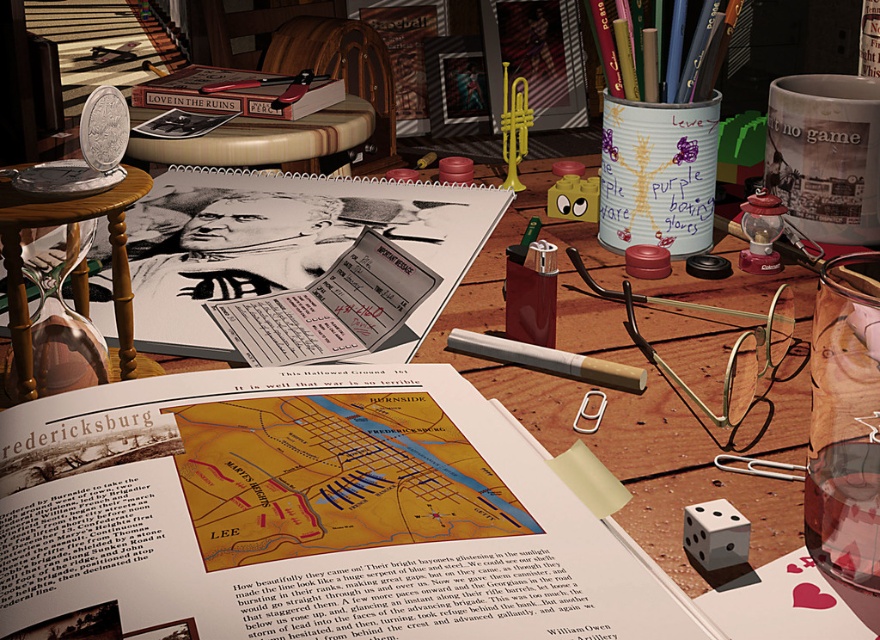
You are organizing a desk and need to place a large decorative item. Which object, the wooden table at center or the metallic pencil case at upper center, would be more suitable for placing a large item on?

The wooden table at center is bigger than the metallic pencil case at upper center, so it would be more suitable for placing a large decorative item.

You are organizing the items on the wooden table at center and the matte paper cigarette at center. Which item is located underneath the other?

The wooden table at center is positioned over matte paper cigarette at center, so the matte paper cigarette at center is underneath the wooden table at center.